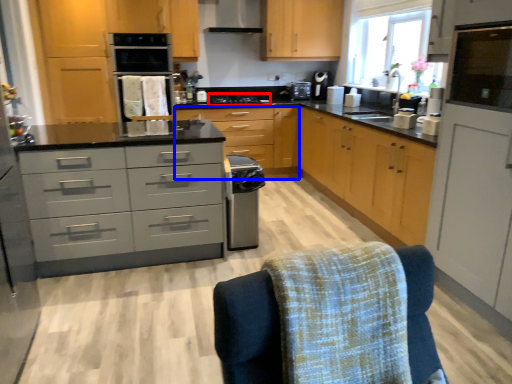
Question: Which point is closer to the camera, stove (highlighted by a red box) or cabinetry (highlighted by a blue box)?

Choices:
 (A) stove
 (B) cabinetry

Answer: (B)